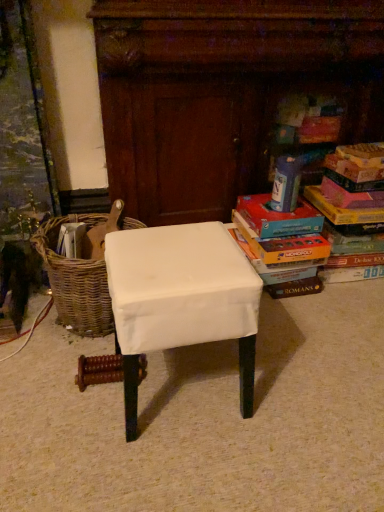
Locate an element on the screen. free location in front of white fabric-covered stool at center is located at coordinates (172, 469).